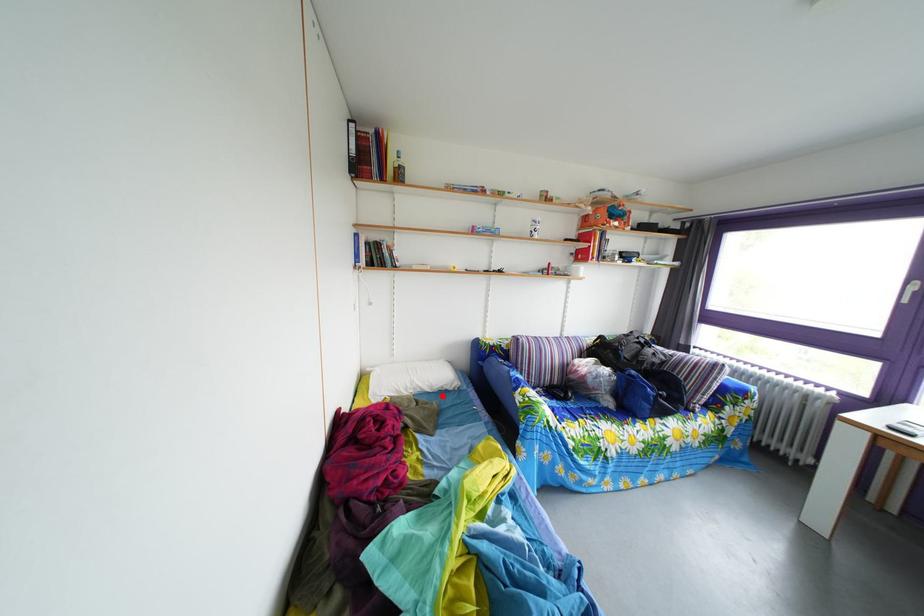
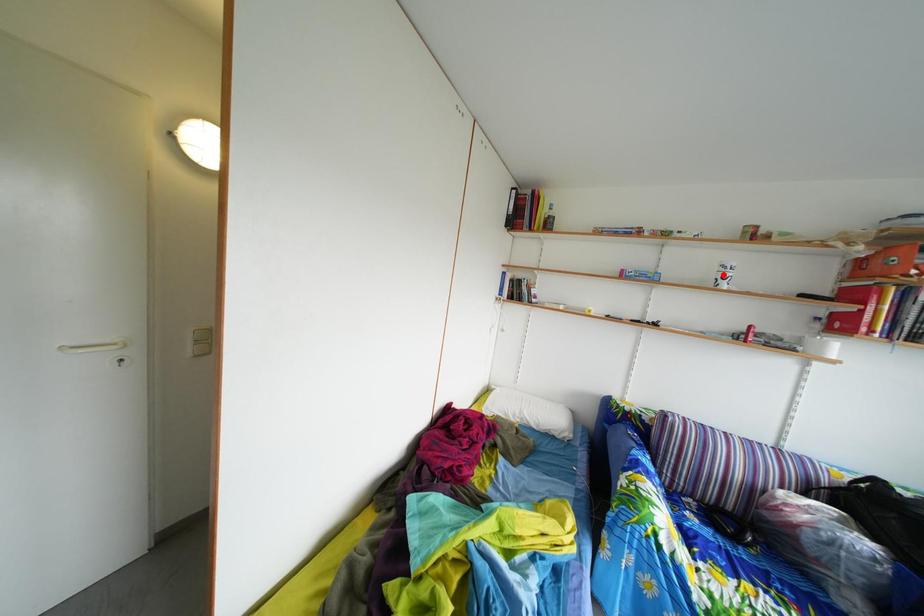
I am providing you with two images of the same scene from different viewpoints. A red point is marked on the first image and another point is marked on the second image. Does the point marked in image1 correspond to the same location as the one in image2?

No